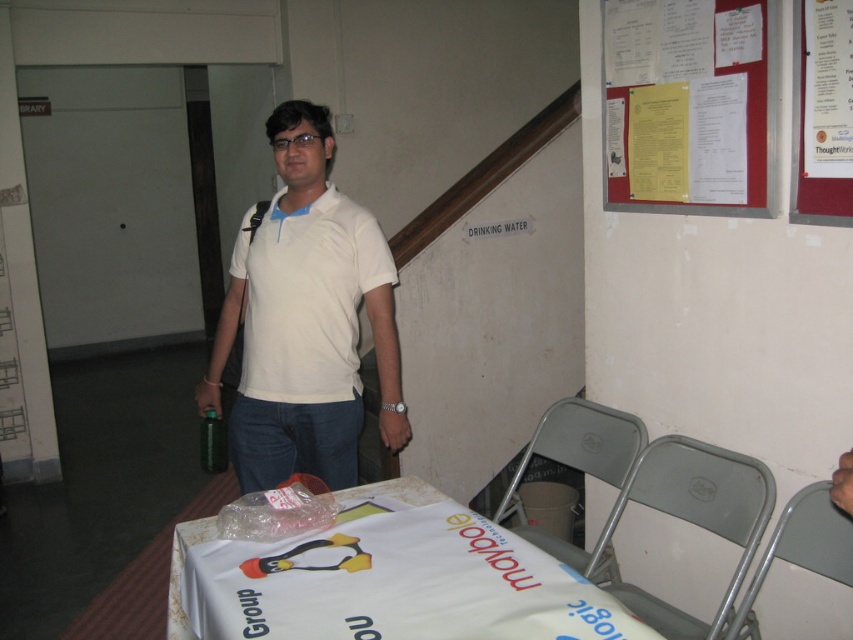
Who is positioned more to the right, white matte polo shirt at center or green matte bottle at center?

From the viewer's perspective, white matte polo shirt at center appears more on the right side.

Does white matte polo shirt at center lie in front of green matte bottle at center?

Yes, it is in front of green matte bottle at center.

Does point (323, 326) come behind point (207, 444)?

No, it is not.

Find the location of a particular element. The width and height of the screenshot is (853, 640). white matte polo shirt at center is located at coordinates (306, 298).

Does white matte shirt at center have a lesser width compared to white matte polo shirt at center?

No, white matte shirt at center is not thinner than white matte polo shirt at center.

Does point (358, 401) lie behind point (270, 285)?

Yes.

At what (x,y) coordinates should I click in order to perform the action: click on white matte shirt at center. Please return your answer as a coordinate pair (x, y). Looking at the image, I should click on (305, 321).

Is red paperboard at upper right closer to the viewer compared to green matte bottle at center?

That is True.

What do you see at coordinates (821, 113) in the screenshot?
I see `red paperboard at upper right` at bounding box center [821, 113].

This screenshot has width=853, height=640. I want to click on red paperboard at upper right, so click(821, 113).